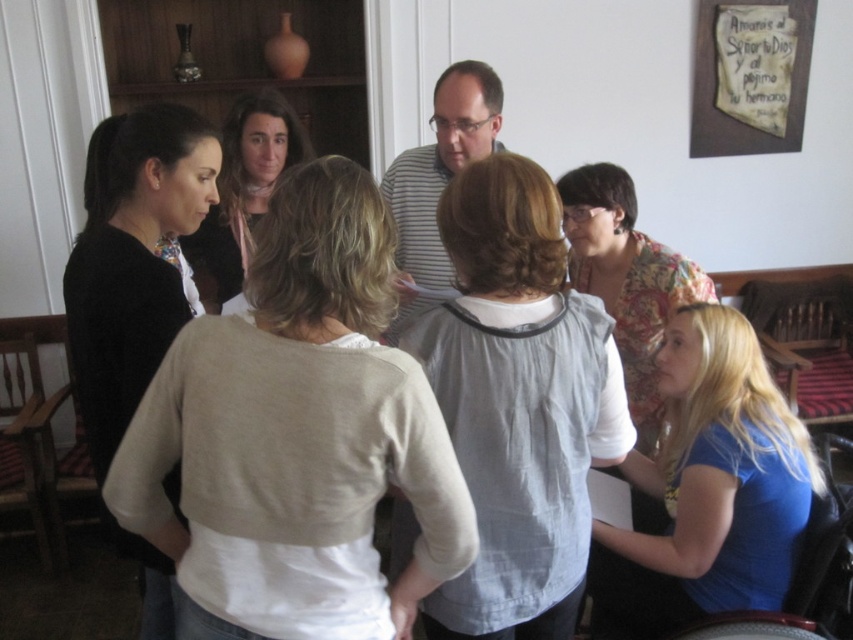
You are taking a photo of the group and want to focus on the two points in the image. Which point, point (358,278) or point (192,179), is closer to your camera?

Point (358,278) is closer to the camera than point (192,179).